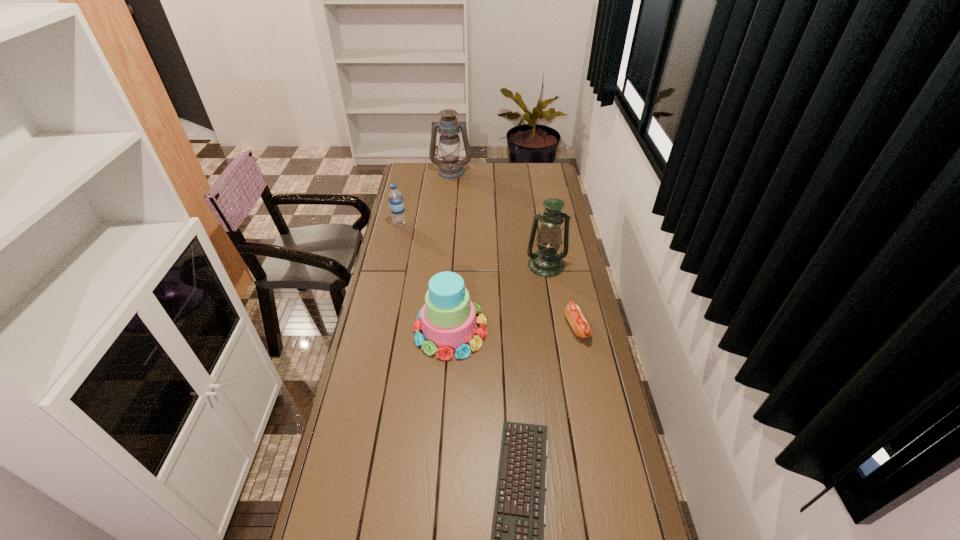
Where is `free space at the right edge of the desktop`? This screenshot has width=960, height=540. free space at the right edge of the desktop is located at coordinates (582, 342).

In the image, there is a desktop. Where is `vacant space at the far left corner`? This screenshot has width=960, height=540. vacant space at the far left corner is located at coordinates (422, 174).

What are the coordinates of `free point between the right oil lamp and the cake` in the screenshot? It's located at (498, 298).

Image resolution: width=960 pixels, height=540 pixels. In order to click on vacant point located between the left oil lamp and the third farthest object in this screenshot , I will do `click(498, 218)`.

Locate an element on the screen. This screenshot has height=540, width=960. unoccupied position between the cake and the right oil lamp is located at coordinates (498, 298).

Locate an element on the screen. This screenshot has height=540, width=960. free space that is in between the second shortest object and the cake is located at coordinates (514, 328).

Locate an element on the screen. free space between the right oil lamp and the second shortest object is located at coordinates (562, 296).

This screenshot has width=960, height=540. I want to click on empty space between the farthest object and the right oil lamp, so click(x=498, y=218).

The width and height of the screenshot is (960, 540). I want to click on free point between the left oil lamp and the fifth tallest object, so click(x=514, y=249).

Identify which object is the third closest to the left oil lamp. Please provide its 2D coordinates. Your answer should be formatted as a tuple, i.e. [(x, y)], where the tuple contains the x and y coordinates of a point satisfying the conditions above.

[(448, 323)]